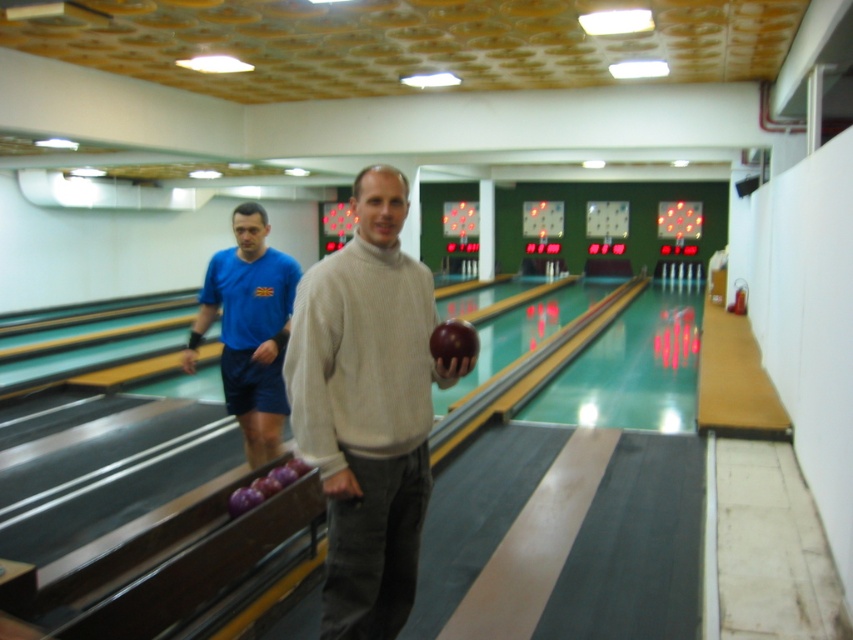
From the picture: You are a photographer setting up a shot in the bowling alley. You need to ensure that the matte white sweater at center and the shiny brown bowling ball at center are both in focus. Given that your camera can only focus on objects within a 10 cm height difference, can both objects be captured clearly in the same frame?

The matte white sweater at center has a greater height compared to shiny brown bowling ball at center. Since the height difference is not specified, but the sweater is taller, it depends on whether the height difference exceeds 10 cm. However, without exact measurements, we cannot confirm if both can be in focus.

You are a photographer trying to capture both the matte white sweater at center and the blue fabric shorts at left in a single shot. Given that your camera can only focus on objects within a 1.5 meter height range, will both subjects be in focus?

The matte white sweater at center is much taller than the blue fabric shorts at left. Since the camera can focus on objects within a 1.5 meter height range, if the height difference between them is less than 1.5 meters, they would both be in focus. However, the description only states the sweater is much taller but doesn not specify the exact height difference. Without knowing the exact height difference, it is impossible to determine if they will both be in focus.

You are a photographer standing in the middle of the bowling alley. You need to take a photo of the matte white sweater at center and the blue fabric shorts at left. Which object should you focus on first to ensure both are in clear view?

The matte white sweater at center is closer to the viewer than the blue fabric shorts at left, so focus on the matte white sweater at center first to ensure both are in clear view.